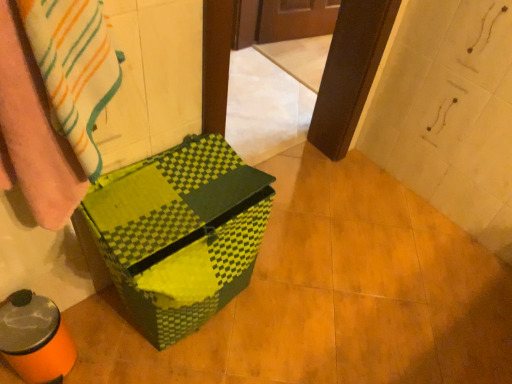
Question: Should I look upward or downward to see striped cotton towel at left?

Choices:
 (A) down
 (B) up

Answer: (B)

Question: Does green checkered cardboard box at center touch striped cotton towel at left?

Choices:
 (A) no
 (B) yes

Answer: (A)

Question: Is green checkered cardboard box at center not within striped cotton towel at left?

Choices:
 (A) no
 (B) yes

Answer: (B)

Question: Does green checkered cardboard box at center have a smaller size compared to striped cotton towel at left?

Choices:
 (A) yes
 (B) no

Answer: (B)

Question: Considering the relative positions of green checkered cardboard box at center and striped cotton towel at left in the image provided, is green checkered cardboard box at center to the left of striped cotton towel at left from the viewer's perspective?

Choices:
 (A) no
 (B) yes

Answer: (A)

Question: Is green checkered cardboard box at center surrounding striped cotton towel at left?

Choices:
 (A) no
 (B) yes

Answer: (A)

Question: Is green checkered cardboard box at center closer to the viewer compared to striped cotton towel at left?

Choices:
 (A) no
 (B) yes

Answer: (A)

Question: From the image's perspective, is striped cotton towel at left under green checkered cardboard box at center?

Choices:
 (A) yes
 (B) no

Answer: (B)

Question: Considering the relative sizes of striped cotton towel at left and green checkered cardboard box at center in the image provided, is striped cotton towel at left shorter than green checkered cardboard box at center?

Choices:
 (A) yes
 (B) no

Answer: (A)

Question: Is green checkered cardboard box at center at the back of striped cotton towel at left?

Choices:
 (A) yes
 (B) no

Answer: (B)

Question: Could you tell me if striped cotton towel at left is turned towards green checkered cardboard box at center?

Choices:
 (A) yes
 (B) no

Answer: (B)

Question: Are striped cotton towel at left and green checkered cardboard box at center located far from each other?

Choices:
 (A) yes
 (B) no

Answer: (B)

Question: Is striped cotton towel at left positioned beyond the bounds of green checkered cardboard box at center?

Choices:
 (A) no
 (B) yes

Answer: (B)

Question: From a real-world perspective, is green checkered cardboard box at center physically located above or below striped cotton towel at left?

Choices:
 (A) above
 (B) below

Answer: (B)